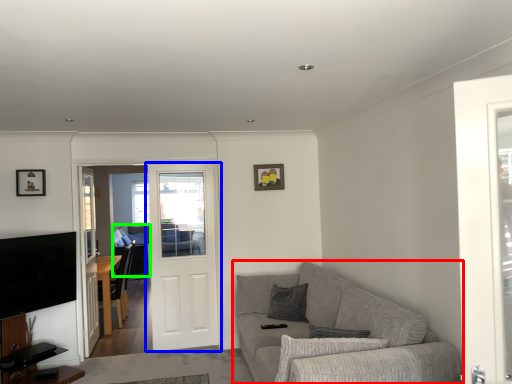
Question: Based on their relative distances, which object is farther from studio couch (highlighted by a red box)? Choose from door (highlighted by a blue box) and couch (highlighted by a green box).

Choices:
 (A) door
 (B) couch

Answer: (B)